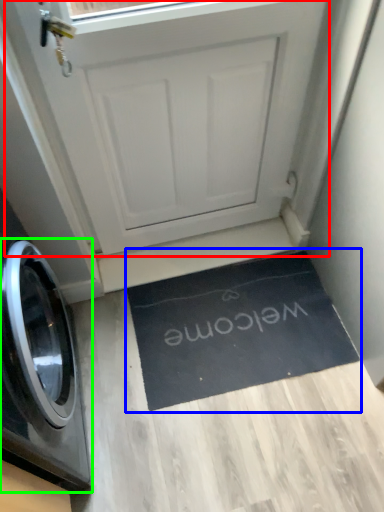
Question: Which is nearer to the screen door (highlighted by a red box)? doormat (highlighted by a blue box) or washing machine (highlighted by a green box).

Choices:
 (A) doormat
 (B) washing machine

Answer: (A)